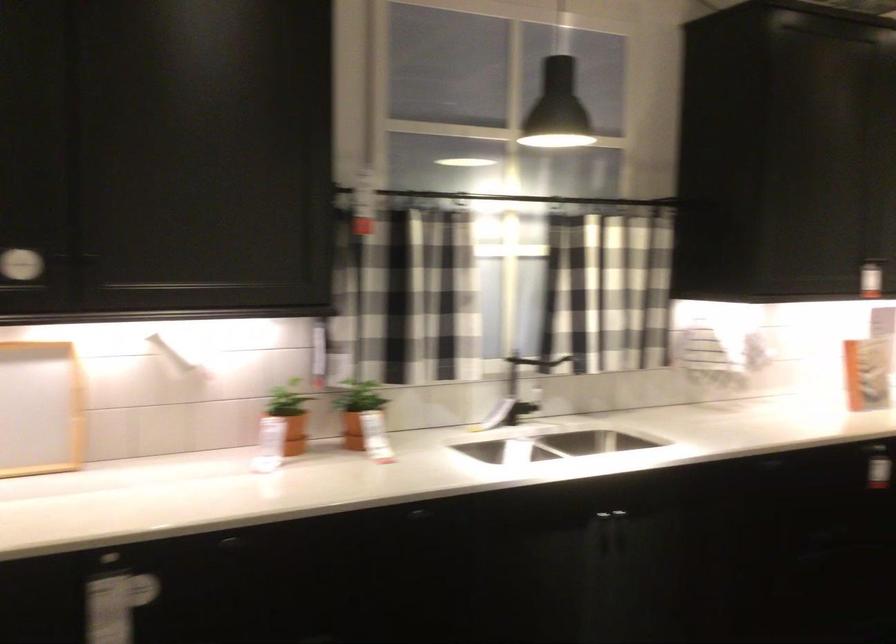
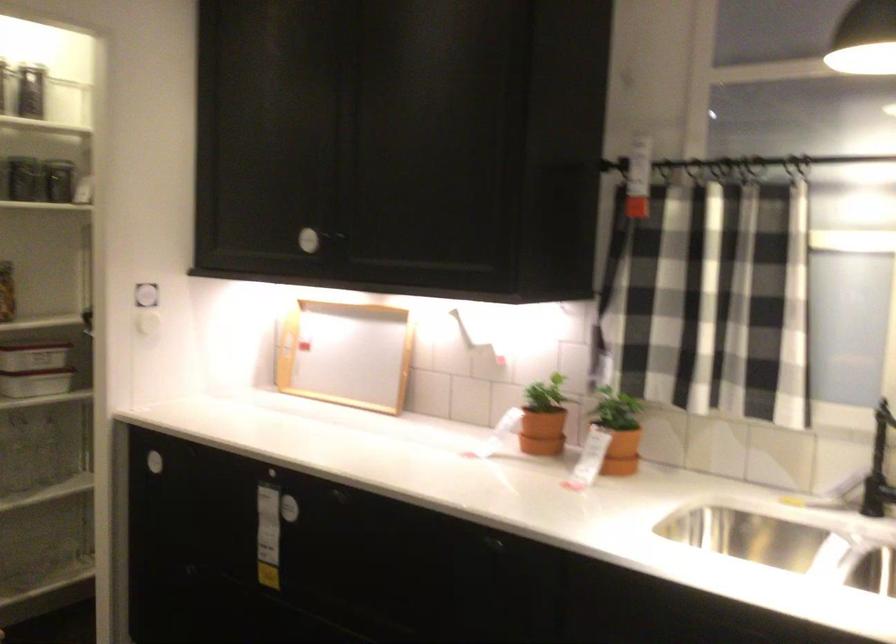
The point at [521,399] is marked in the first image. Where is the corresponding point in the second image?

(879, 468)